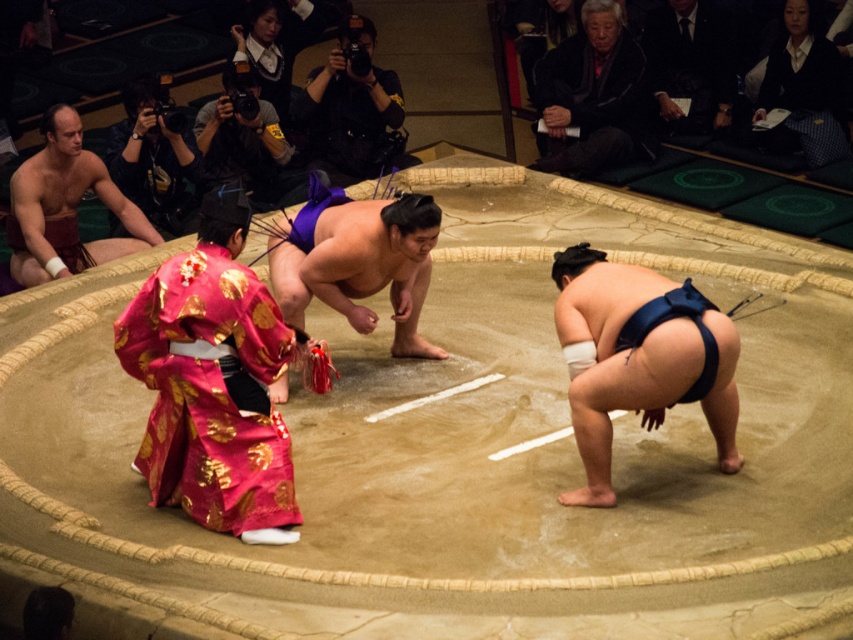
Locate an element on the screen. black woolen sweater at upper center is located at coordinates (593, 97).

Looking at this image, who is more distant from viewer, (x=595, y=19) or (x=167, y=216)?

Positioned behind is point (x=595, y=19).

Locate an element on the screen. black woolen sweater at upper center is located at coordinates (593, 97).

Is point (666, 100) positioned behind point (242, 173)?

Yes, point (666, 100) is farther from viewer.

Looking at this image, is black fabric at upper right to the right of matte black camera at upper left from the viewer's perspective?

Indeed, black fabric at upper right is positioned on the right side of matte black camera at upper left.

Who is more distant from viewer, (688, 0) or (258, 132)?

The point (688, 0) is behind.

In order to click on black fabric at upper right in this screenshot , I will do `click(689, 65)`.

Which of these two, black camera at upper left or matte black camera at upper left, stands taller?

black camera at upper left is taller.

Is point (187, 209) less distant than point (204, 138)?

Yes, it is.

I want to click on black camera at upper left, so click(154, 161).